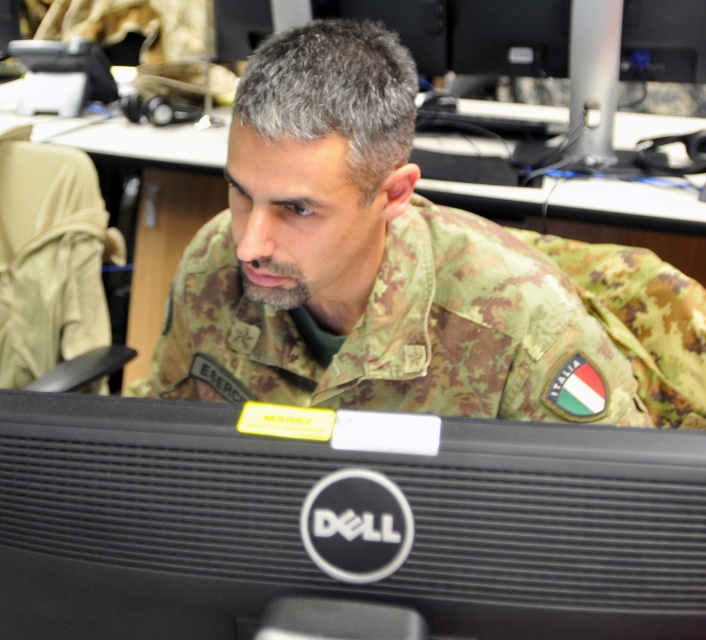
Question: Which object is farther from the camera taking this photo?

Choices:
 (A) camouflage fabric uniform at center
 (B) black plastic monitor at center

Answer: (A)

Question: Which object appears farthest from the camera in this image?

Choices:
 (A) camouflage fabric uniform at center
 (B) black plastic monitor at center

Answer: (A)

Question: Can you confirm if black plastic monitor at center is positioned to the right of camouflage fabric uniform at center?

Choices:
 (A) no
 (B) yes

Answer: (A)

Question: Does black plastic monitor at center have a smaller size compared to camouflage fabric uniform at center?

Choices:
 (A) yes
 (B) no

Answer: (A)

Question: Is black plastic monitor at center positioned before camouflage fabric uniform at center?

Choices:
 (A) yes
 (B) no

Answer: (A)